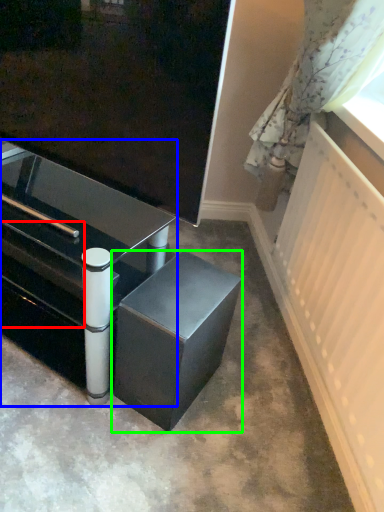
Question: Estimate the real-world distances between objects in this image. Which object is farther from drawer (highlighted by a red box), table (highlighted by a blue box) or furniture (highlighted by a green box)?

Choices:
 (A) table
 (B) furniture

Answer: (B)